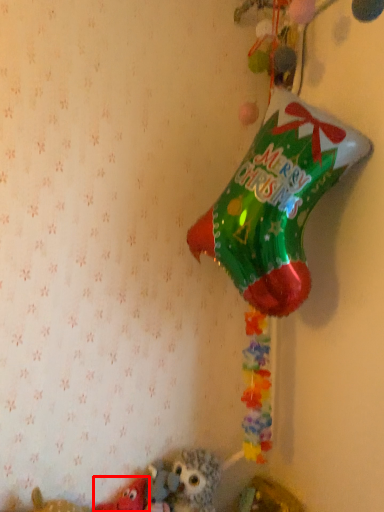
Question: In this image, where is toy (annotated by the red box) located relative to toy?

Choices:
 (A) left
 (B) right

Answer: (A)